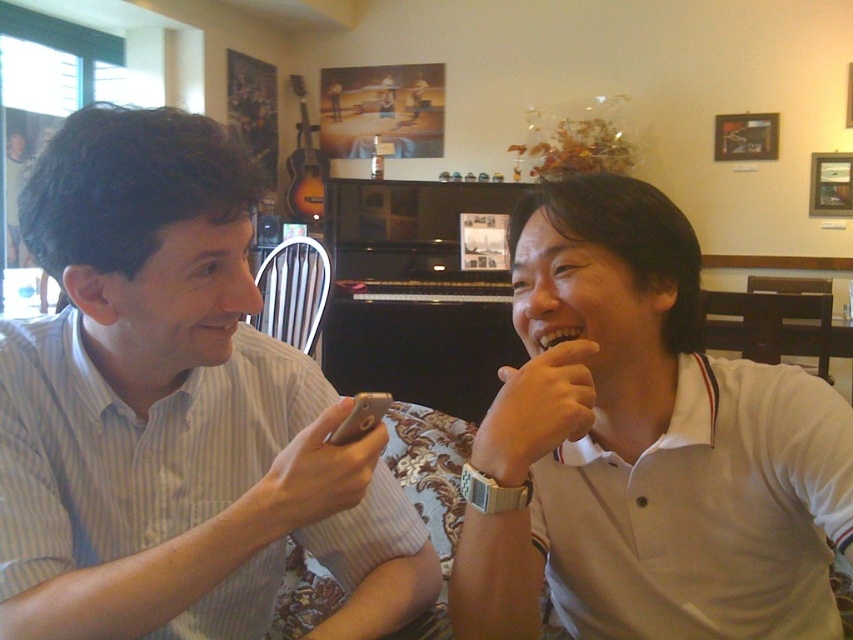
You are a photographer trying to capture a candid shot of the light brown striped shirt at center. If your camera has a focus point at coordinate 0.645, 0.205, will it align with the shirt?

Yes, the light brown striped shirt at center is positioned exactly at point [173,412], so the camera focus point will align with it.

You are a photographer trying to capture the scene where the two people are interacting. You want to ensure that both the light brown striped shirt at center and the white cotton shirt at right are clearly visible in the photo. Based on their positions, which shirt should you focus on first to ensure proper exposure, considering one is higher than the other?

The light brown striped shirt at center is above the white cotton shirt at right, so you should focus on the light brown striped shirt at center first to ensure proper exposure since it is higher in the frame.